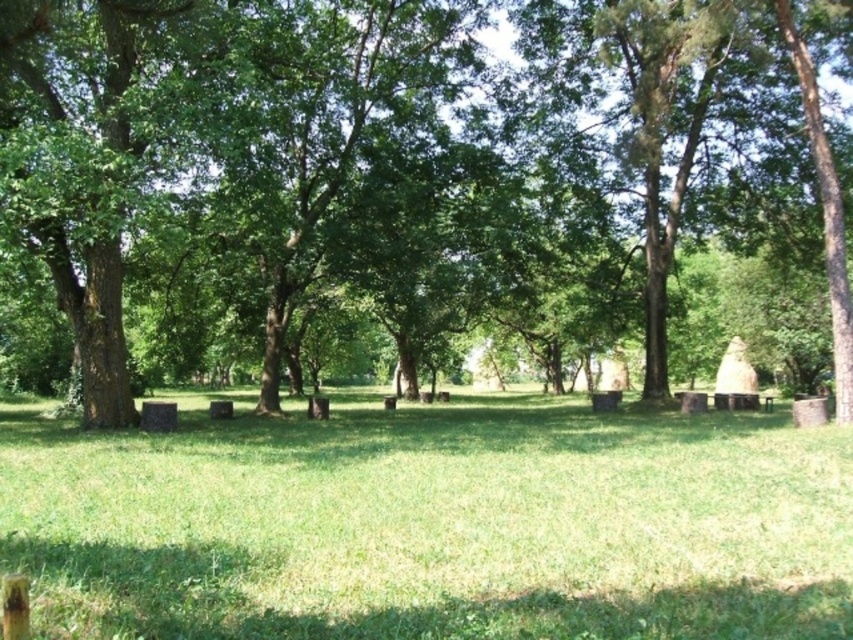
You are a gardener planning to plant a new tree in the park. You notice the brown rough tree at center and the green grassy field at center. Which area would require more space to accommodate a larger tree, and why?

The brown rough tree at center requires more space because it is bigger than the green grassy field at center.

Based on the photo, where is the brown rough tree at center located in the image?

The brown rough tree at center is located at point [415,160] in the image.